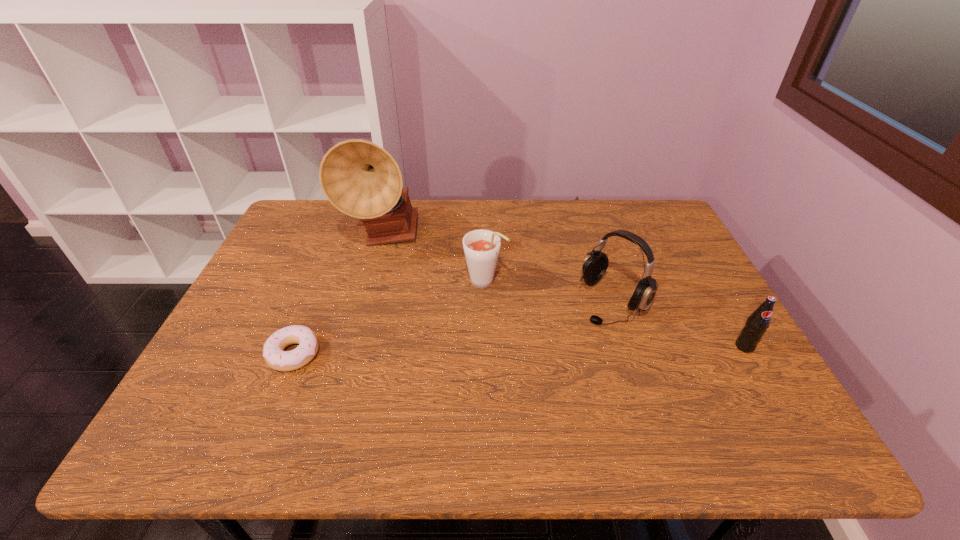
Locate an element on the screen. Image resolution: width=960 pixels, height=540 pixels. vacant space on the desktop that is between the doughnut and the second shortest object and is positioned on the horn of the tallest object is located at coordinates (468, 351).

Where is `vacant space on the desktop that is between the doughnut and the pop and is positioned with the microphone on the side of the fourth object from left to right`? vacant space on the desktop that is between the doughnut and the pop and is positioned with the microphone on the side of the fourth object from left to right is located at coordinates (556, 349).

Where is `free space on the desktop that is between the doughnut and the rightmost object and is positioned on the drink side of the root beer`? This screenshot has height=540, width=960. free space on the desktop that is between the doughnut and the rightmost object and is positioned on the drink side of the root beer is located at coordinates (571, 349).